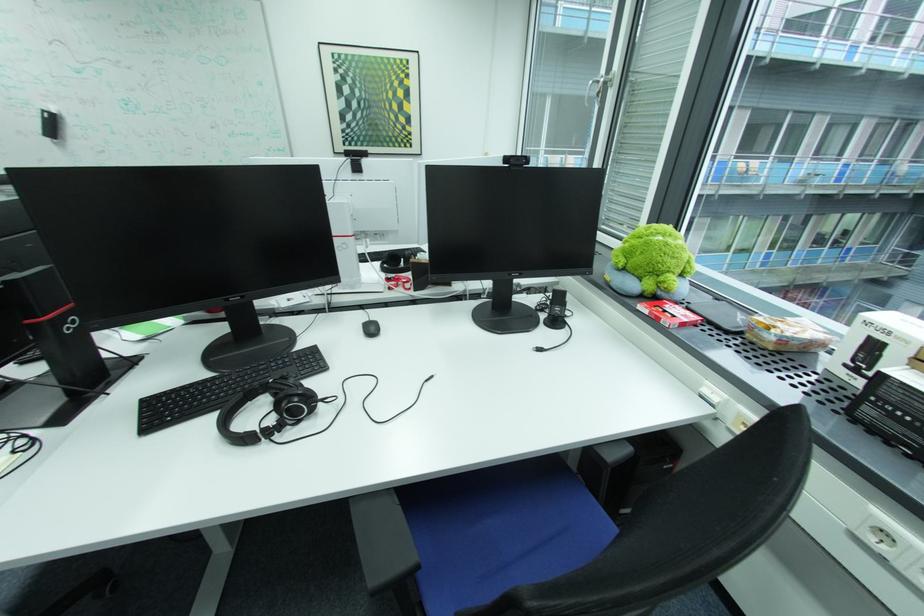
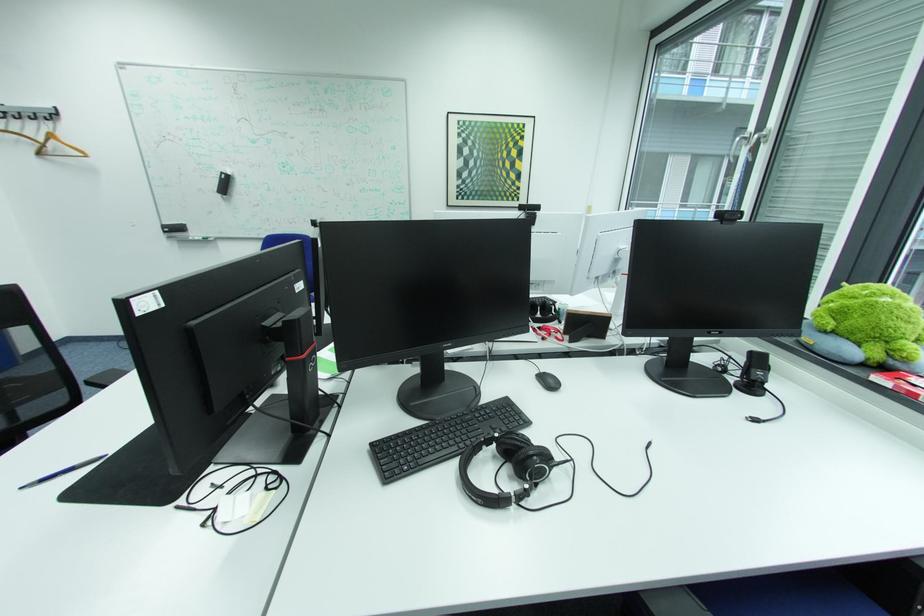
Find the pixel in the second image that matches point 181,392 in the first image.

(406, 437)